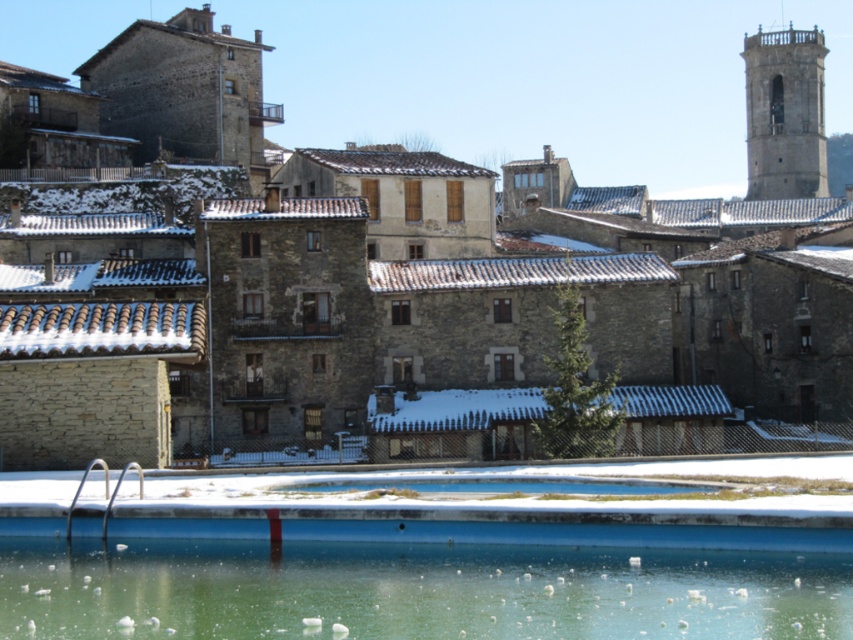
Question: Which of the following is the farthest from the observer?

Choices:
 (A) blue concrete pool at lower center
 (B) stone buildings at center

Answer: (B)

Question: Can you confirm if blue concrete pool at lower center is smaller than gray stone tower at upper right?

Choices:
 (A) no
 (B) yes

Answer: (B)

Question: Which point appears farthest from the camera in this image?

Choices:
 (A) (747, 22)
 (B) (144, 636)
 (C) (757, 99)

Answer: (A)

Question: Which of the following is the farthest from the observer?

Choices:
 (A) blue concrete pool at lower center
 (B) stone buildings at center

Answer: (B)

Question: Does stone buildings at center appear on the right side of gray stone tower at upper right?

Choices:
 (A) yes
 (B) no

Answer: (B)

Question: Can you confirm if stone buildings at center is smaller than gray stone tower at upper right?

Choices:
 (A) no
 (B) yes

Answer: (A)